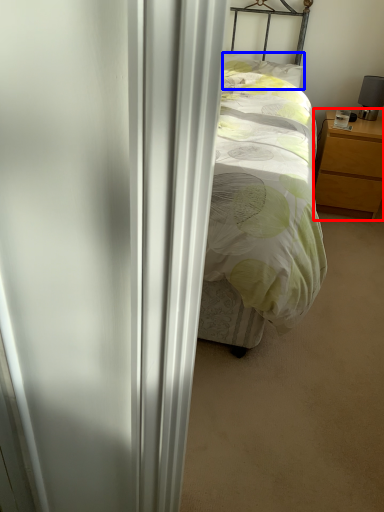
Question: Which of the following is the closest to the observer, nightstand (highlighted by a red box) or pillow (highlighted by a blue box)?

Choices:
 (A) nightstand
 (B) pillow

Answer: (A)